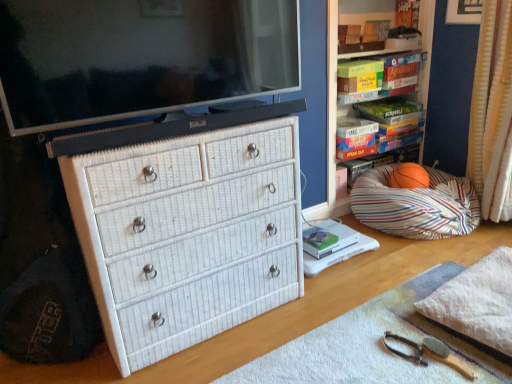
Question: Does hardcover book at center, which is counted as the first book, starting from the left, have a smaller size compared to hardcover book at upper right, positioned as the 1th book in top-to-bottom order?

Choices:
 (A) yes
 (B) no

Answer: (A)

Question: Does hardcover book at center, the first book from the front, appear on the right side of hardcover book at upper right, the 2th book viewed from the left?

Choices:
 (A) yes
 (B) no

Answer: (B)

Question: From a real-world perspective, is hardcover book at center, the second book when ordered from right to left, located higher than hardcover book at upper right, the 1th book when ordered from right to left?

Choices:
 (A) yes
 (B) no

Answer: (B)

Question: Is hardcover book at center, which appears as the first book when ordered from the bottom, looking in the opposite direction of hardcover book at upper right, acting as the 1th book starting from the back?

Choices:
 (A) no
 (B) yes

Answer: (A)

Question: Can you confirm if hardcover book at center, which is counted as the first book, starting from the left, is bigger than hardcover book at upper right, the 1th book when ordered from right to left?

Choices:
 (A) no
 (B) yes

Answer: (A)

Question: Looking at the image, does wooden brush at lower right seem bigger or smaller compared to hardcover book at upper right, the 1th book when ordered from right to left?

Choices:
 (A) small
 (B) big

Answer: (A)

Question: Is point (x=443, y=362) closer or farther from the camera than point (x=348, y=84)?

Choices:
 (A) closer
 (B) farther

Answer: (A)

Question: Do you think wooden brush at lower right is within hardcover book at upper right, which appears as the second book when ordered from the bottom, or outside of it?

Choices:
 (A) inside
 (B) outside

Answer: (B)

Question: In terms of width, does wooden brush at lower right look wider or thinner when compared to hardcover book at upper right, acting as the 1th book starting from the back?

Choices:
 (A) thin
 (B) wide

Answer: (A)

Question: From the image's perspective, relative to white textured curtain at right, is matte black flat-screen tv at upper center above or below?

Choices:
 (A) below
 (B) above

Answer: (B)

Question: From a real-world perspective, is matte black flat-screen tv at upper center physically located above or below white textured curtain at right?

Choices:
 (A) above
 (B) below

Answer: (A)

Question: Considering the positions of point (244, 69) and point (488, 44), is point (244, 69) closer or farther from the camera than point (488, 44)?

Choices:
 (A) closer
 (B) farther

Answer: (A)

Question: Is matte black flat-screen tv at upper center in front of or behind white textured curtain at right in the image?

Choices:
 (A) front
 (B) behind

Answer: (A)

Question: Is hardcover book at upper right, the 1th book when ordered from right to left, wider or thinner than matte black flat-screen tv at upper center?

Choices:
 (A) thin
 (B) wide

Answer: (B)

Question: From the image's perspective, relative to matte black flat-screen tv at upper center, is hardcover book at upper right, the 1th book when ordered from right to left, above or below?

Choices:
 (A) below
 (B) above

Answer: (B)